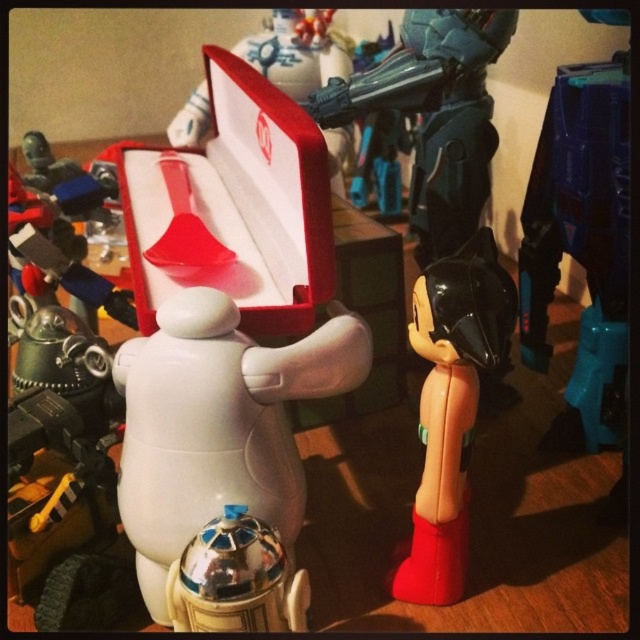
Who is higher up, metallic blue robot at upper center or shiny metallic droid at center?

metallic blue robot at upper center is higher up.

Which is in front, point (461, 49) or point (234, 554)?

Positioned in front is point (234, 554).

Find the location of a particular element. The width and height of the screenshot is (640, 640). metallic blue robot at upper center is located at coordinates (435, 115).

Between white plastic robot at center and teal plastic robot at upper right, which one is positioned higher?

teal plastic robot at upper right is higher up.

Does white plastic robot at center have a greater height compared to teal plastic robot at upper right?

Incorrect, white plastic robot at center's height is not larger of teal plastic robot at upper right's.

Locate an element on the screen. white plastic robot at center is located at coordinates (218, 424).

The width and height of the screenshot is (640, 640). Describe the element at coordinates (435, 115) in the screenshot. I see `metallic blue robot at upper center` at that location.

Is metallic blue robot at upper center thinner than red velvet box at center?

Yes.

Which is in front, point (458, 58) or point (332, 179)?

Point (458, 58) is in front.

Where is `metallic blue robot at upper center`? Image resolution: width=640 pixels, height=640 pixels. metallic blue robot at upper center is located at coordinates (435, 115).